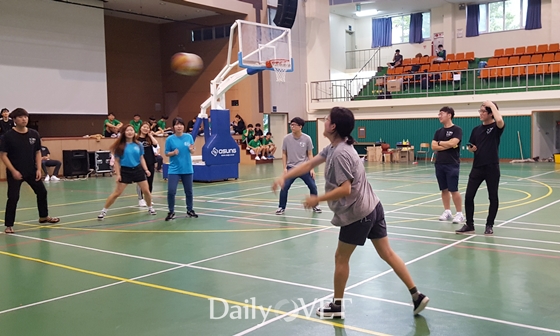
Find the location of a particular element. window is located at coordinates (395, 32), (407, 27), (424, 26), (484, 20), (496, 9), (511, 20), (522, 11).